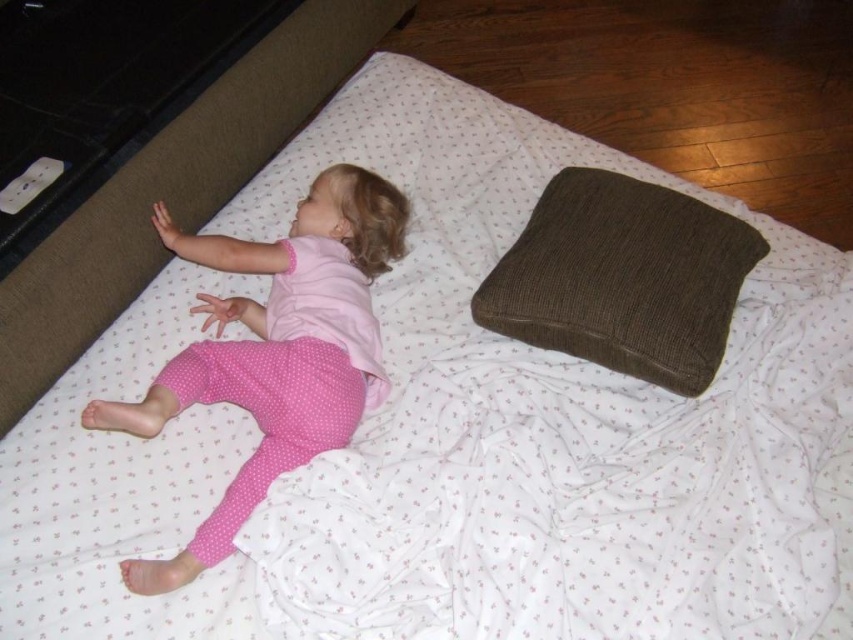
Is pink polka dot pajamas at center bigger than brown corduroy pillow at upper right?

Indeed, pink polka dot pajamas at center has a larger size compared to brown corduroy pillow at upper right.

Locate an element on the screen. The image size is (853, 640). pink polka dot pajamas at center is located at coordinates (276, 349).